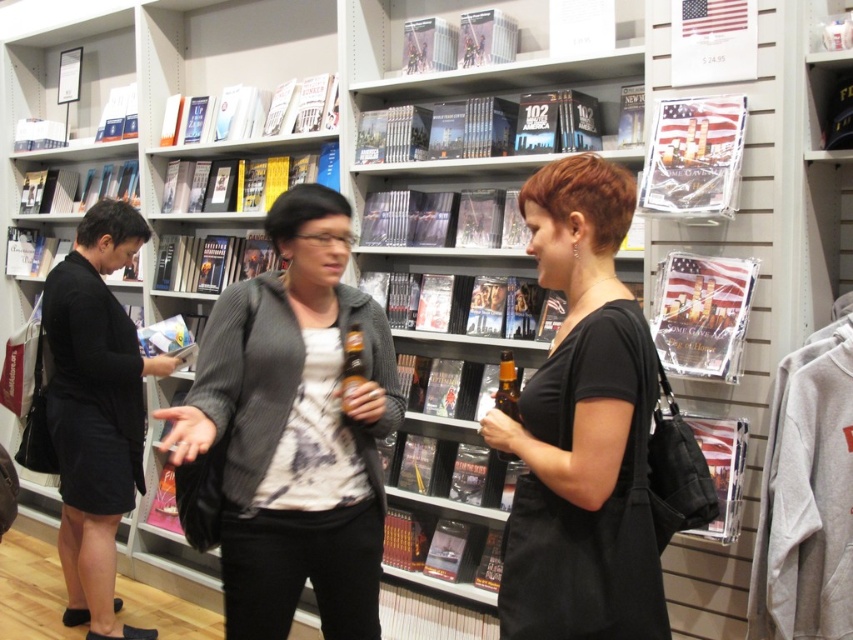
Question: From the image, what is the correct spatial relationship of gray textured jacket at center in relation to black matte dress at left?

Choices:
 (A) below
 (B) above

Answer: (B)

Question: Which of the following is the farthest from the observer?

Choices:
 (A) black matte shirt at center
 (B) black matte dress at left

Answer: (B)

Question: Is black matte shirt at center positioned behind black matte dress at left?

Choices:
 (A) yes
 (B) no

Answer: (B)

Question: Which point is closer to the camera?

Choices:
 (A) (338, 403)
 (B) (67, 390)

Answer: (A)

Question: Which of the following is the closest to the observer?

Choices:
 (A) black matte shirt at center
 (B) black matte dress at left

Answer: (A)

Question: Can you confirm if black matte shirt at center is wider than black matte dress at left?

Choices:
 (A) yes
 (B) no

Answer: (B)